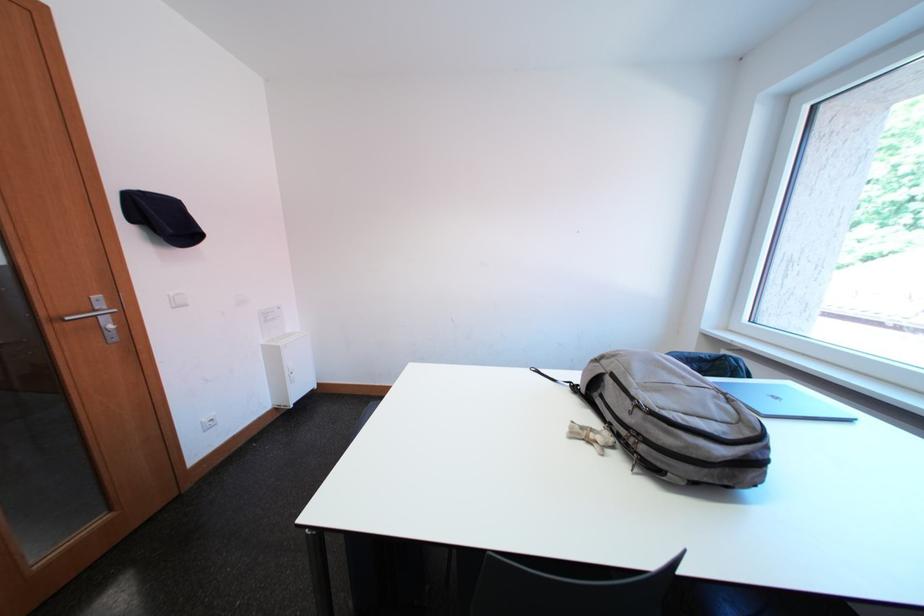
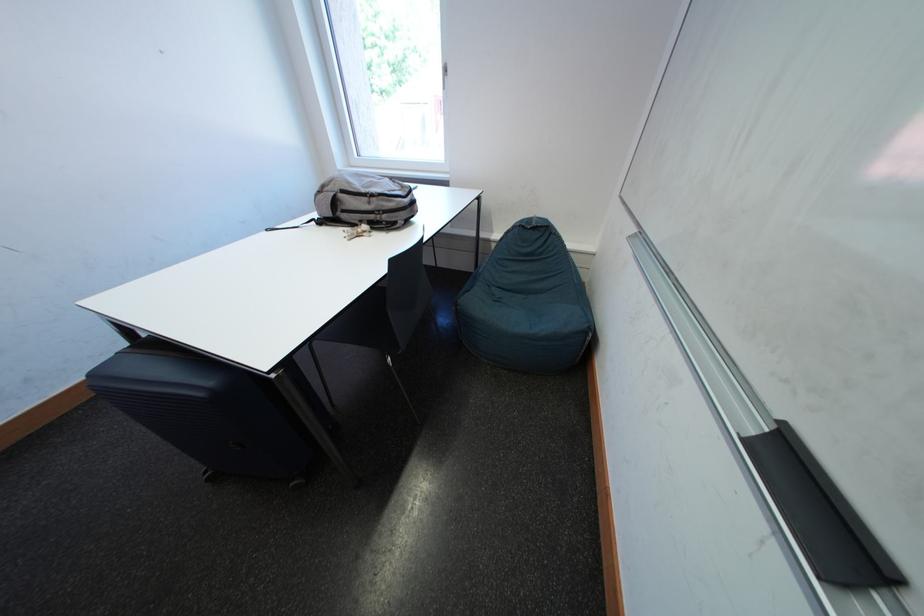
In the second image, find the point that corresponds to (597,440) in the first image.

(368, 236)